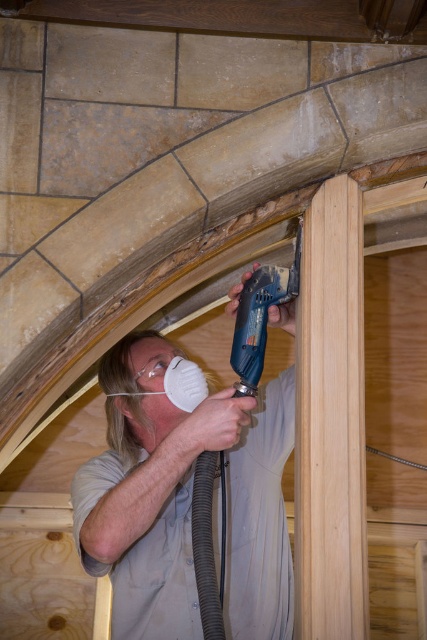
Which is below, matte blue drill at center or blue plastic drill at center?

matte blue drill at center is below.

Is point (234, 612) more distant than point (236, 387)?

That is False.

Is point (240, 420) farther from camera compared to point (254, 376)?

No, it is not.

Locate an element on the screen. matte blue drill at center is located at coordinates (184, 499).